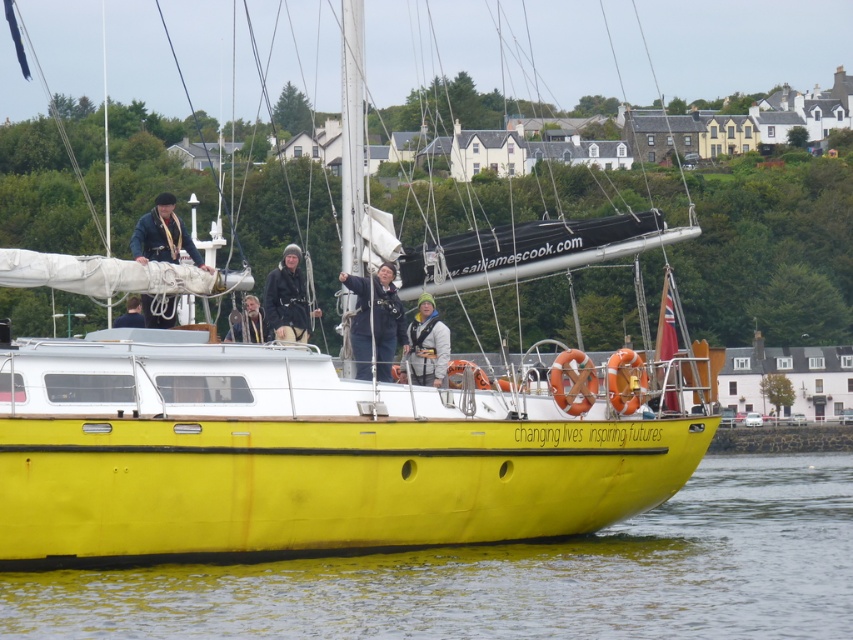
Question: Is dark gray knit hat at center to the left of orange rubber life jacket at right from the viewer's perspective?

Choices:
 (A) yes
 (B) no

Answer: (A)

Question: Observing the image, what is the correct spatial positioning of smooth wooden figure at center in reference to orange fabric life jacket at center?

Choices:
 (A) below
 (B) above

Answer: (B)

Question: Where is yellow matte water at lower center located in relation to matte blue jacket at upper left in the image?

Choices:
 (A) above
 (B) below

Answer: (B)

Question: Which point is farther to the camera?

Choices:
 (A) dark gray knit hat at center
 (B) matte black jacket at upper center

Answer: (B)

Question: Which object is the farthest from the matte black jacket at center?

Choices:
 (A) orange rubber life jacket at right
 (B) yellow matte water at lower center
 (C) orange rubber life jacket at center

Answer: (B)

Question: Which object is positioned farthest from the orange fabric life jacket at center?

Choices:
 (A) dark gray knit hat at center
 (B) matte blue jacket at upper left
 (C) orange rubber life jacket at center

Answer: (B)